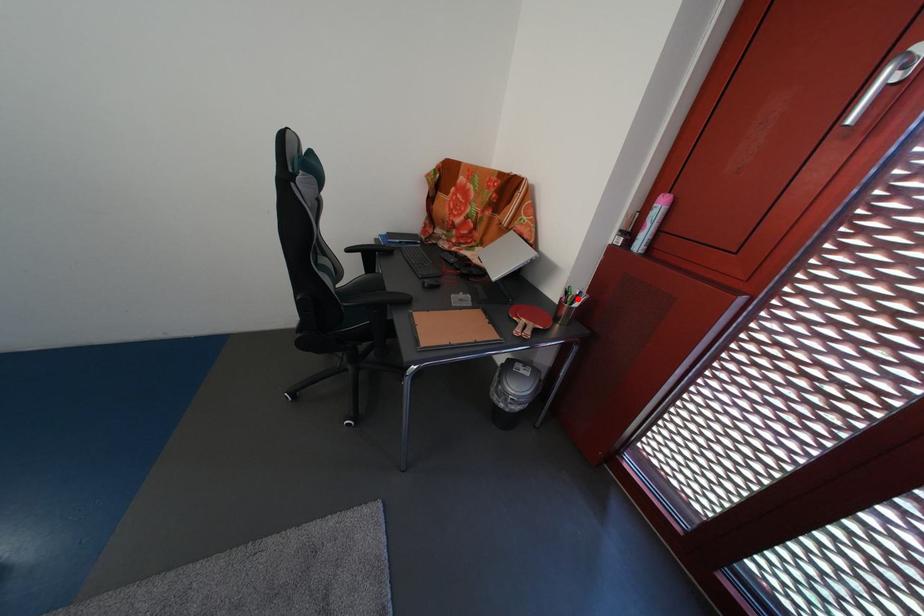
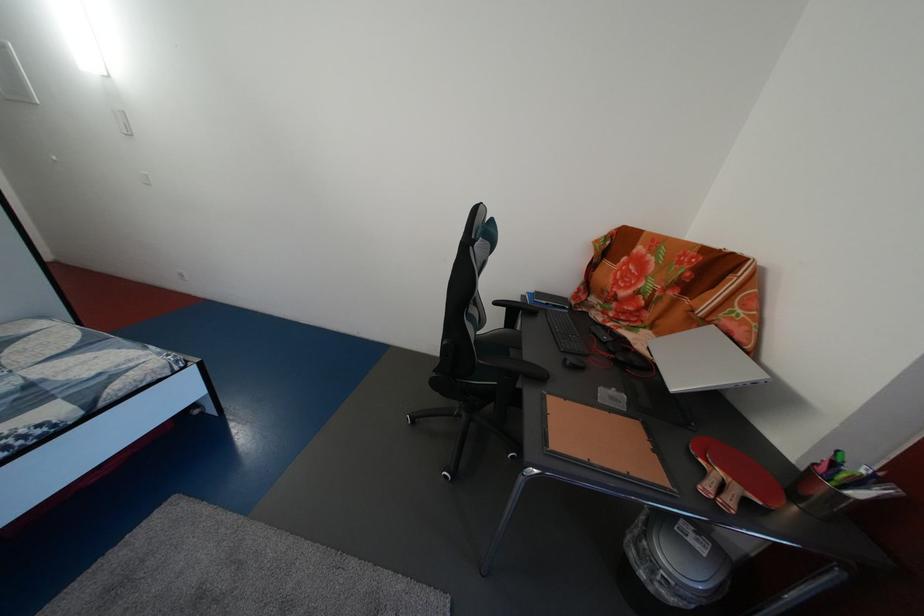
Question: I am providing you with two images of the same scene from different viewpoints. A red point is shown in image1. For the corresponding object point in image2, is it positioned nearer or farther from the camera?

Choices:
 (A) Nearer
 (B) Farther

Answer: (B)